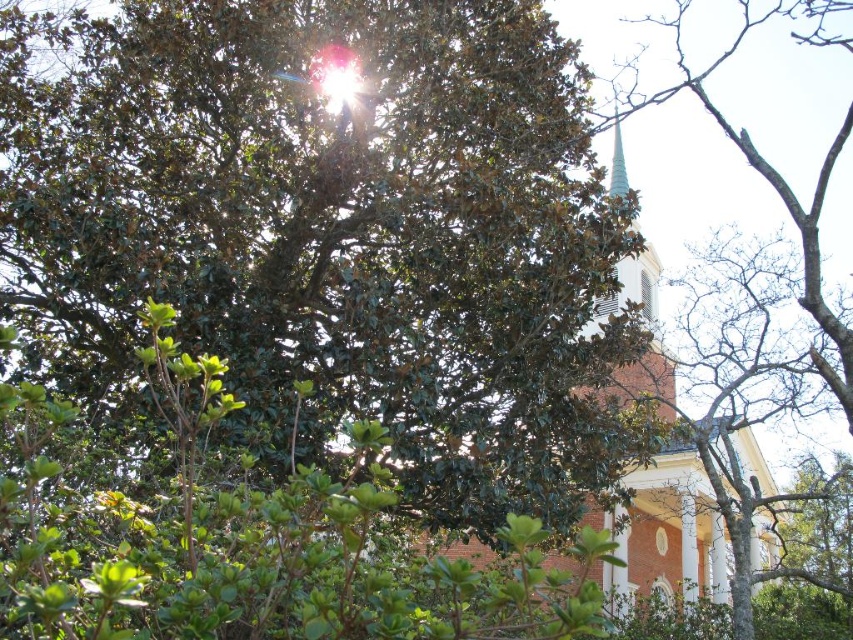
Question: Which point is farther to the camera?

Choices:
 (A) (610, 180)
 (B) (845, 390)

Answer: (A)

Question: Which object is positioned closest to the green leafy tree at upper right?

Choices:
 (A) green glass spire at upper center
 (B) white brick church at center

Answer: (A)

Question: Which object is closer to the camera taking this photo?

Choices:
 (A) white brick church at center
 (B) green glass spire at upper center

Answer: (B)

Question: Can you confirm if white brick church at center is wider than green leafy tree at upper right?

Choices:
 (A) yes
 (B) no

Answer: (B)

Question: Can you confirm if green leafy tree at upper right is wider than green glass spire at upper center?

Choices:
 (A) yes
 (B) no

Answer: (A)

Question: Does green leafy tree at upper right have a smaller size compared to green glass spire at upper center?

Choices:
 (A) no
 (B) yes

Answer: (A)